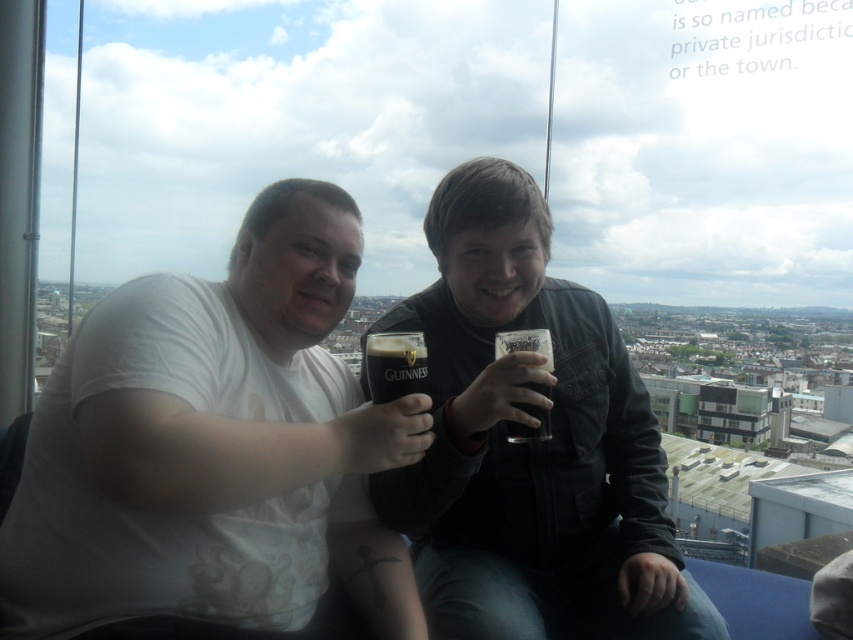
How distant is white matte t-shirt at left from dark brown glass at center?

They are 22.16 meters apart.

Is white matte t-shirt at left wider than dark brown glass at center?

Correct, the width of white matte t-shirt at left exceeds that of dark brown glass at center.

Find the location of a particular element. The width and height of the screenshot is (853, 640). white matte t-shirt at left is located at coordinates (215, 445).

You are a GUI agent. You are given a task and a screenshot of the screen. Output one action in this format:
    pyautogui.click(x=<x>, y=<y>)
    Task: Click on the white matte t-shirt at left
    
    Given the screenshot: What is the action you would take?
    pyautogui.click(x=215, y=445)

Is white matte t-shirt at left smaller than matte black jacket at center?

Incorrect, white matte t-shirt at left is not smaller in size than matte black jacket at center.

Is white matte t-shirt at left above matte black jacket at center?

Incorrect, white matte t-shirt at left is not positioned above matte black jacket at center.

Is point (273, 433) positioned in front of point (453, 580)?

Yes, it is.

Image resolution: width=853 pixels, height=640 pixels. Identify the location of white matte t-shirt at left. (215, 445).

Which is above, guinness dark glass at center or dark brown glass at center?

guinness dark glass at center

Which is in front, point (378, 396) or point (514, 344)?

Point (378, 396) is in front.

The image size is (853, 640). In order to click on guinness dark glass at center in this screenshot , I will do pyautogui.click(x=393, y=364).